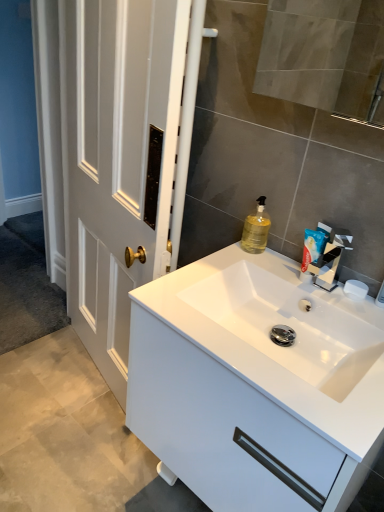
Question: Is silver metallic tap at upper right wider or thinner than translucent yellow liquid at sink right?

Choices:
 (A) wide
 (B) thin

Answer: (A)

Question: In the image, is silver metallic tap at upper right positioned in front of or behind translucent yellow liquid at sink right?

Choices:
 (A) behind
 (B) front

Answer: (B)

Question: Considering the real-world distances, which object is closest to the white matte soap at right?

Choices:
 (A) translucent yellow liquid at sink right
 (B) silver metallic tap at upper right
 (C) white plastic toothpaste tube at upper right
 (D) white glossy cabinet at center

Answer: (B)

Question: Estimate the real-world distances between objects in this image. Which object is closer to the translucent yellow liquid at sink right?

Choices:
 (A) white glossy cabinet at center
 (B) white matte soap at right
 (C) silver metallic tap at upper right
 (D) white plastic toothpaste tube at upper right

Answer: (D)